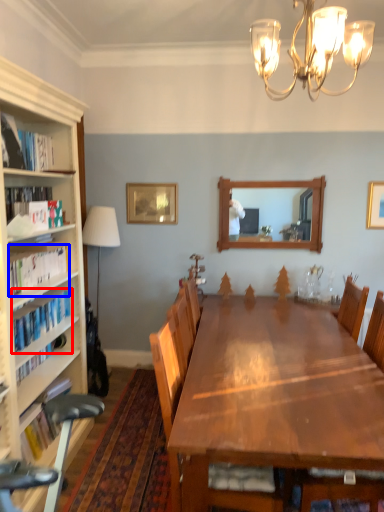
Question: Which of the following is the closest to the observer, book (highlighted by a red box) or book (highlighted by a blue box)?

Choices:
 (A) book
 (B) book

Answer: (B)